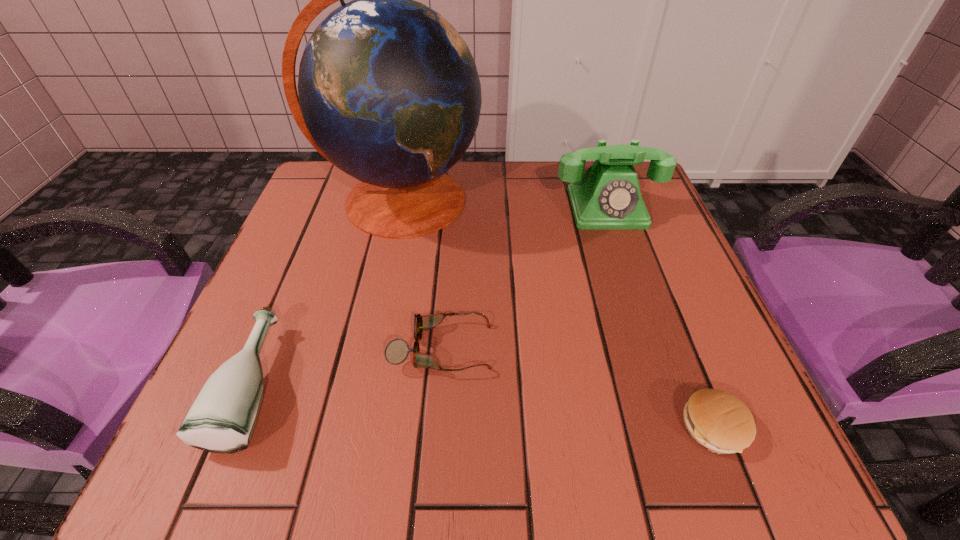
Locate an element on the screen. object that is positioned at the far right corner is located at coordinates (607, 196).

Where is `object that is at the near right corner`? The width and height of the screenshot is (960, 540). object that is at the near right corner is located at coordinates (717, 420).

The height and width of the screenshot is (540, 960). In order to click on free space at the far edge of the desktop in this screenshot , I will do `click(569, 202)`.

I want to click on vacant space at the near edge, so click(624, 453).

At what (x,y) coordinates should I click in order to perform the action: click on free spot at the left edge of the desktop. Please return your answer as a coordinate pair (x, y). This screenshot has width=960, height=540. Looking at the image, I should click on (331, 323).

You are a GUI agent. You are given a task and a screenshot of the screen. Output one action in this format:
    pyautogui.click(x=<x>, y=<y>)
    Task: Click on the free location at the right edge
    This screenshot has width=960, height=540.
    Given the screenshot: What is the action you would take?
    pyautogui.click(x=622, y=289)

Locate an element on the screen. free spot between the patty and the telephone is located at coordinates (660, 318).

Identify the location of empty space between the patty and the spectacles. (578, 388).

The height and width of the screenshot is (540, 960). Identify the location of vacant point located between the tallest object and the spectacles. (420, 274).

Where is `unoccupied area between the fourth shortest object and the tallest object`? This screenshot has height=540, width=960. unoccupied area between the fourth shortest object and the tallest object is located at coordinates (503, 204).